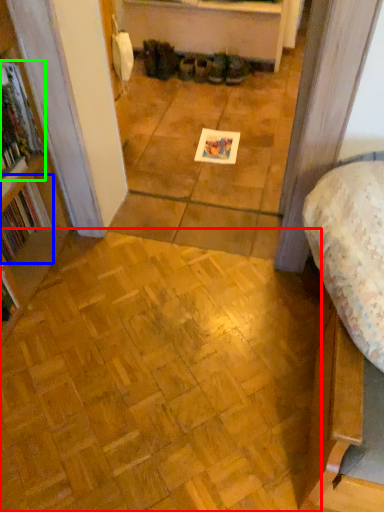
Question: Based on their relative distances, which object is farther from plywood (highlighted by a red box)? Choose from book (highlighted by a blue box) and book (highlighted by a green box).

Choices:
 (A) book
 (B) book

Answer: (B)